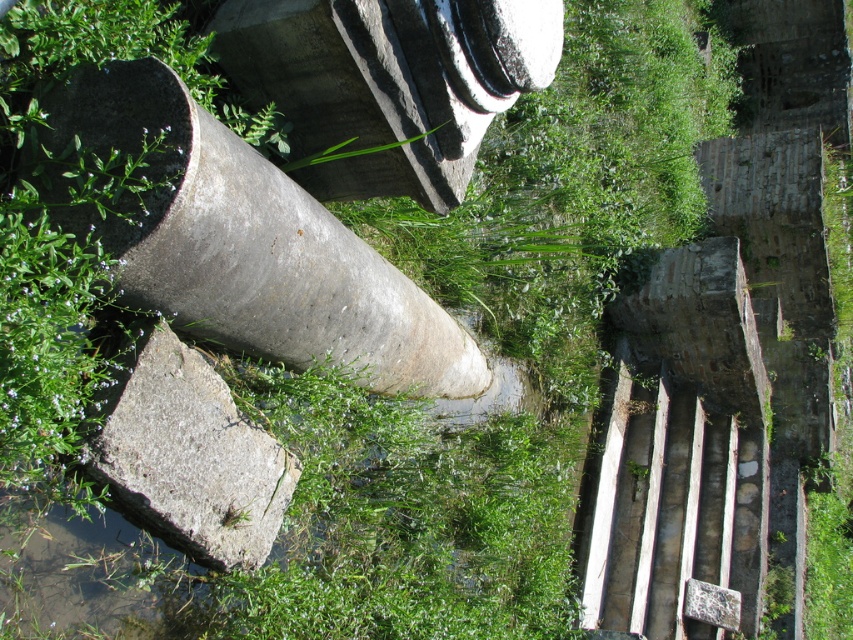
Looking at this image, who is positioned more to the right, rusty metallic water pipe at center-left or gray rough concrete at lower left?

Positioned to the right is rusty metallic water pipe at center-left.

Between point (270, 264) and point (129, 506), which one is positioned behind?

The point (270, 264) is behind.

Describe the element at coordinates (248, 244) in the screenshot. I see `rusty metallic water pipe at center-left` at that location.

The height and width of the screenshot is (640, 853). I want to click on rusty metallic water pipe at center-left, so click(x=248, y=244).